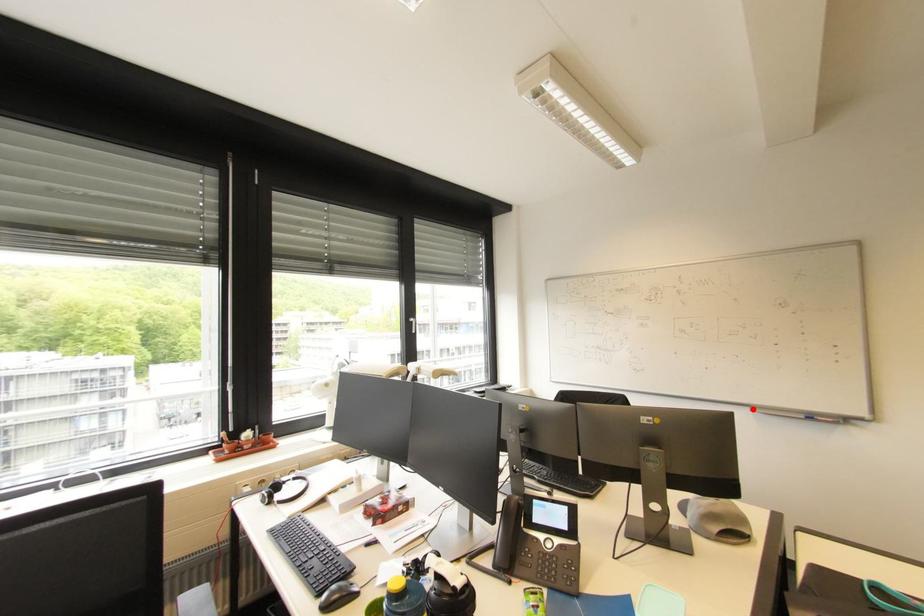
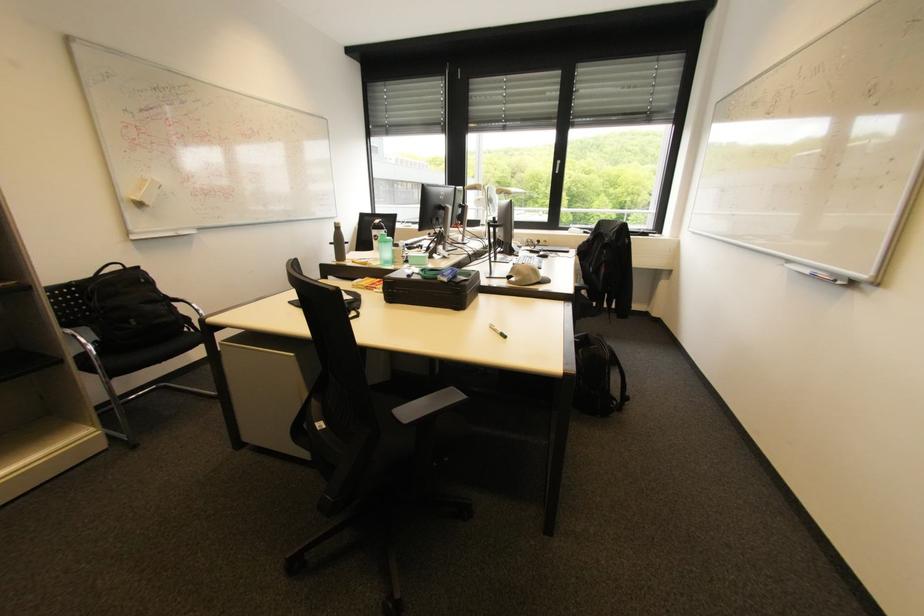
Where in the second image is the point corresponding to the highlighted location from the first image?

(789, 262)